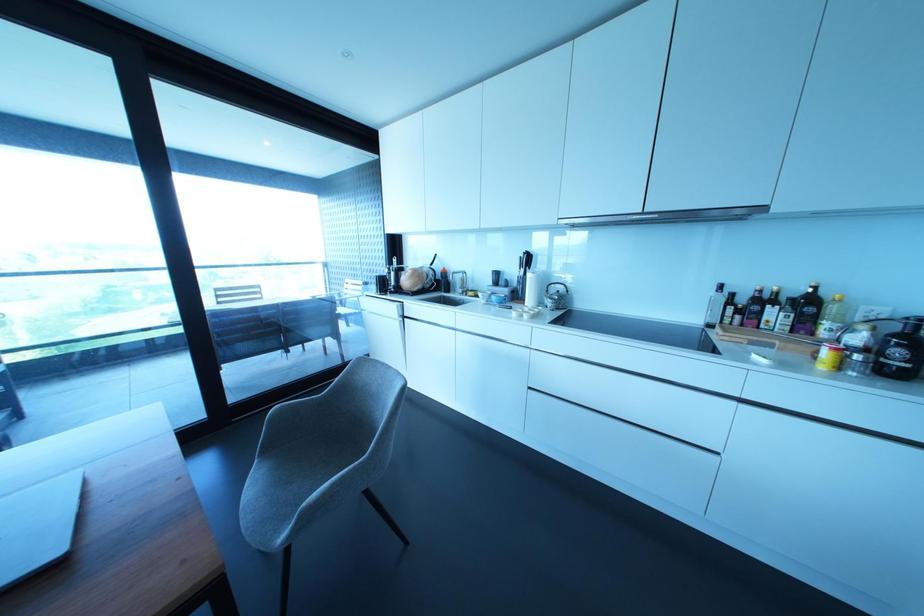
Where is `blue mug`? blue mug is located at coordinates (497, 298).